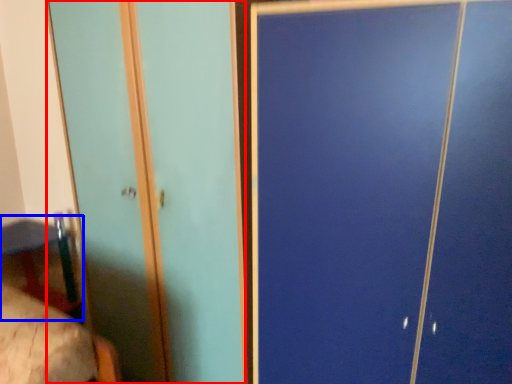
Question: Among these objects, which one is nearest to the camera, screen door (highlighted by a red box) or table (highlighted by a blue box)?

Choices:
 (A) screen door
 (B) table

Answer: (A)